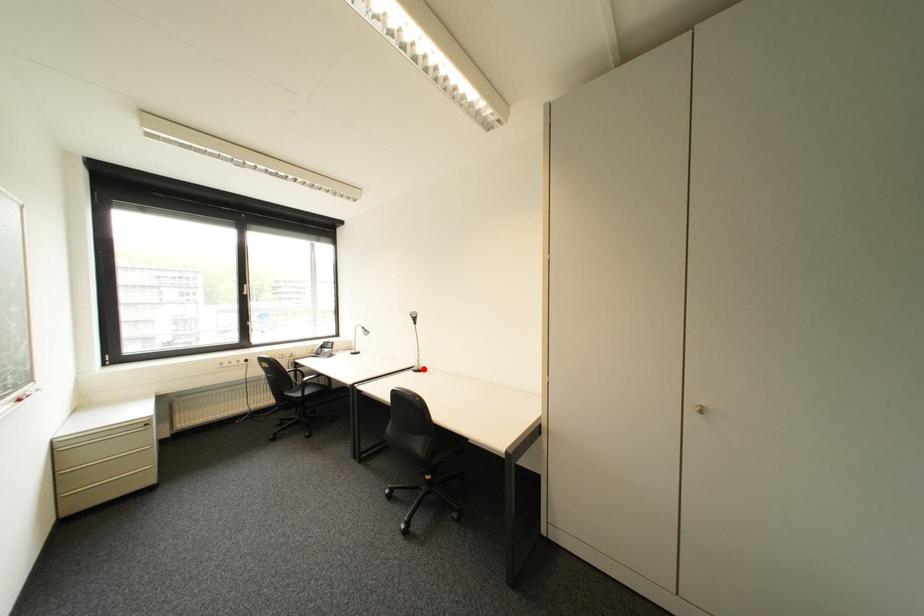
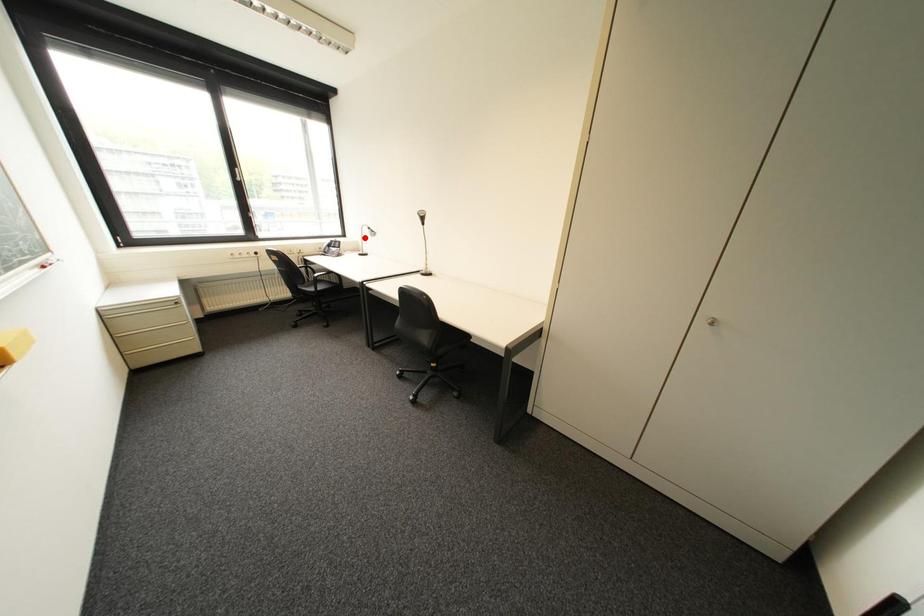
I am providing you with two images of the same scene from different viewpoints. A red point is marked on the first image and another point is marked on the second image. Is the marked point in image1 the same physical position as the marked point in image2?

No